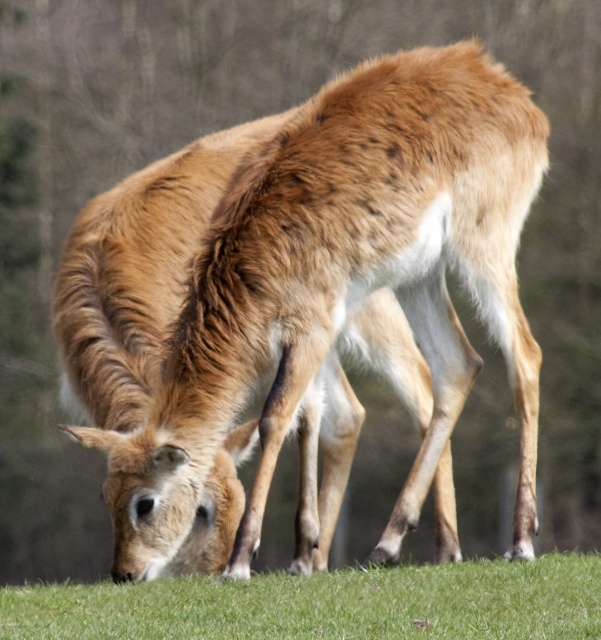
Question: Does brown fur deer at center appear under green grass at lower center?

Choices:
 (A) yes
 (B) no

Answer: (B)

Question: Is brown fur deer at center to the left of green grass at lower center from the viewer's perspective?

Choices:
 (A) yes
 (B) no

Answer: (B)

Question: Which object is closer to the camera taking this photo?

Choices:
 (A) green grass at lower center
 (B) brown fur deer at center

Answer: (A)

Question: Which point is closer to the camera taking this photo?

Choices:
 (A) (483, 106)
 (B) (498, 632)

Answer: (B)

Question: Can you confirm if brown fur deer at center is positioned to the left of green grass at lower center?

Choices:
 (A) yes
 (B) no

Answer: (B)

Question: Which object appears closest to the camera in this image?

Choices:
 (A) green grass at lower center
 (B) brown fur deer at center

Answer: (A)